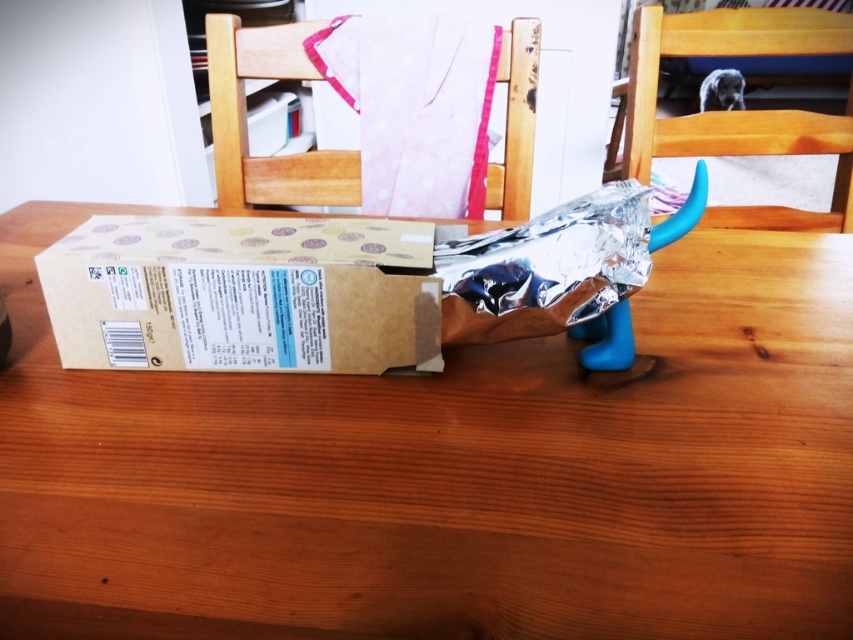
Between wooden table at center and pink fabric at upper center, which one has less height?

pink fabric at upper center is shorter.

The image size is (853, 640). What do you see at coordinates (450, 472) in the screenshot?
I see `wooden table at center` at bounding box center [450, 472].

Locate an element on the screen. The width and height of the screenshot is (853, 640). wooden table at center is located at coordinates (450, 472).

Can you confirm if brown cardboard box at center is positioned above wooden chair at upper right?

No, brown cardboard box at center is not above wooden chair at upper right.

Does point (334, 314) come farther from viewer compared to point (798, 228)?

No, (334, 314) is closer to viewer.

Identify the location of brown cardboard box at center. This screenshot has width=853, height=640. 241,292.

Can you confirm if wooden table at center is bigger than wooden chair at upper right?

Indeed, wooden table at center has a larger size compared to wooden chair at upper right.

Can you confirm if wooden table at center is thinner than wooden chair at upper right?

Incorrect, wooden table at center's width is not less than wooden chair at upper right's.

Where is `wooden table at center`? wooden table at center is located at coordinates (450, 472).